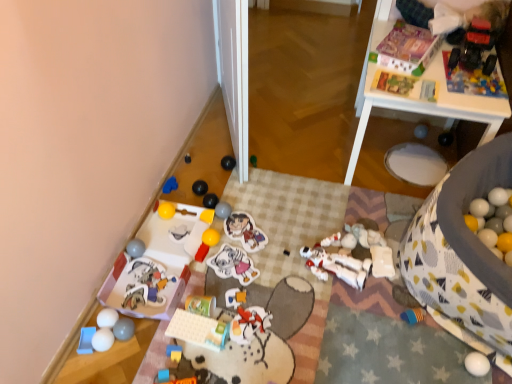
Identify the location of free space above matte plastic toy at lower left, the 5th toy in the left-to-right sequence (from a real-world perspective). (145, 282).